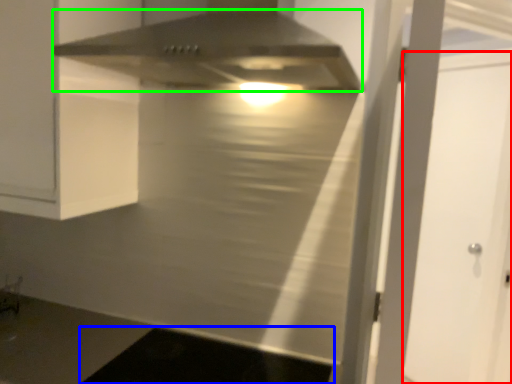
Question: Which object is positioned farthest from glass door (highlighted by a red box)? Select from dark (highlighted by a blue box) and home appliance (highlighted by a green box).

Choices:
 (A) dark
 (B) home appliance

Answer: (B)